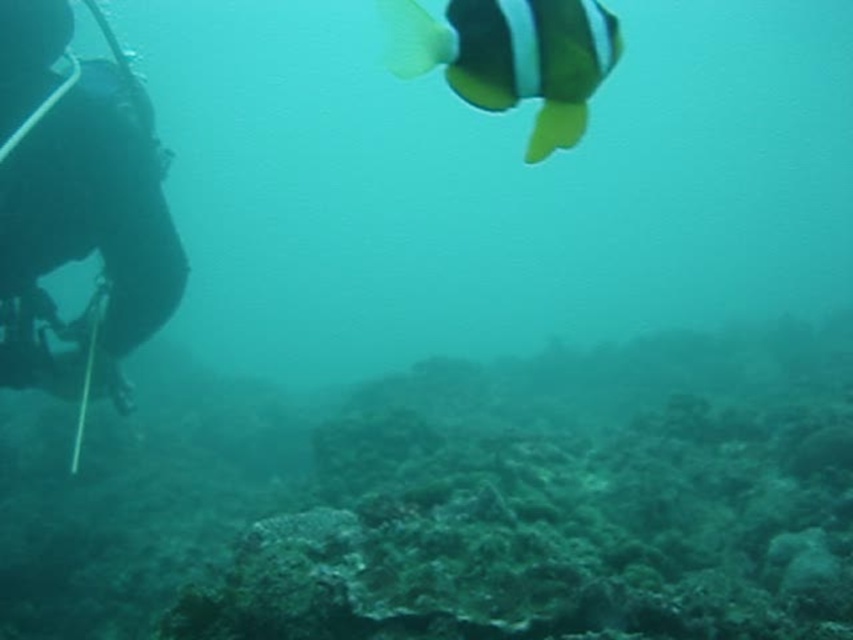
Does black rubber wetsuit at left lie behind black matte fish at upper center?

Yes.

Which of these two, black rubber wetsuit at left or black matte fish at upper center, stands taller?

black rubber wetsuit at left is taller.

Is point (120, 337) less distant than point (547, 109)?

No, (120, 337) is further to viewer.

Identify the location of black rubber wetsuit at left. The width and height of the screenshot is (853, 640). [93, 216].

Between green mossy coral reef at center and black rubber wetsuit at left, which one appears on the right side from the viewer's perspective?

Positioned to the right is green mossy coral reef at center.

Is green mossy coral reef at center wider than black rubber wetsuit at left?

Correct, the width of green mossy coral reef at center exceeds that of black rubber wetsuit at left.

Which is in front, point (149, 404) or point (108, 365)?

Point (108, 365)

Where is `green mossy coral reef at center`? Image resolution: width=853 pixels, height=640 pixels. green mossy coral reef at center is located at coordinates (450, 499).

Which of these two, green mossy coral reef at center or black matte fish at upper center, stands taller?

green mossy coral reef at center

Is green mossy coral reef at center to the left of black matte fish at upper center from the viewer's perspective?

Indeed, green mossy coral reef at center is positioned on the left side of black matte fish at upper center.

Which is in front, point (662, 352) or point (550, 51)?

Point (550, 51) is in front.

Find the location of a particular element. The image size is (853, 640). green mossy coral reef at center is located at coordinates (450, 499).